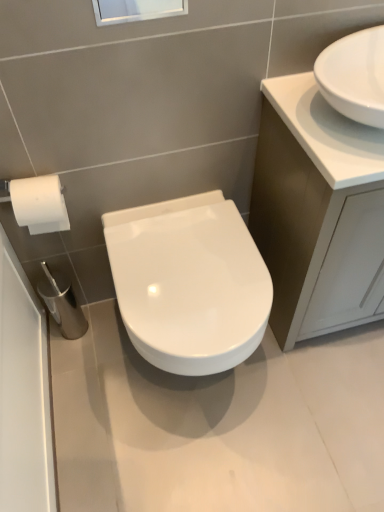
Question: Does transparent glass window screen at upper center turn towards white glossy sink at upper right?

Choices:
 (A) no
 (B) yes

Answer: (A)

Question: Could white glossy sink at upper right be considered to be inside transparent glass window screen at upper center?

Choices:
 (A) yes
 (B) no

Answer: (B)

Question: Is transparent glass window screen at upper center positioned before white glossy sink at upper right?

Choices:
 (A) yes
 (B) no

Answer: (B)

Question: Does transparent glass window screen at upper center touch white glossy sink at upper right?

Choices:
 (A) yes
 (B) no

Answer: (B)

Question: Is transparent glass window screen at upper center to the left of white glossy sink at upper right from the viewer's perspective?

Choices:
 (A) yes
 (B) no

Answer: (A)

Question: From their relative heights in the image, would you say white glossy cabinet at upper right is taller or shorter than white glossy sink at upper right?

Choices:
 (A) tall
 (B) short

Answer: (A)

Question: In the image, is white glossy cabinet at upper right on the left side or the right side of white glossy sink at upper right?

Choices:
 (A) right
 (B) left

Answer: (A)

Question: Looking at their shapes, would you say white glossy cabinet at upper right is wider or thinner than white glossy sink at upper right?

Choices:
 (A) wide
 (B) thin

Answer: (A)

Question: Is white glossy cabinet at upper right bigger or smaller than white glossy sink at upper right?

Choices:
 (A) small
 (B) big

Answer: (B)

Question: Do you think transparent glass window screen at upper center is within white glossy sink at upper right, or outside of it?

Choices:
 (A) outside
 (B) inside

Answer: (A)

Question: Is point (160, 15) closer or farther from the camera than point (291, 108)?

Choices:
 (A) farther
 (B) closer

Answer: (B)

Question: From the image's perspective, is transparent glass window screen at upper center located above or below white glossy sink at upper right?

Choices:
 (A) below
 (B) above

Answer: (B)

Question: Considering the positions of transparent glass window screen at upper center and white glossy sink at upper right in the image, is transparent glass window screen at upper center taller or shorter than white glossy sink at upper right?

Choices:
 (A) short
 (B) tall

Answer: (B)

Question: Is white glossy cabinet at upper right situated inside transparent glass window screen at upper center or outside?

Choices:
 (A) inside
 (B) outside

Answer: (B)

Question: Is point (286, 261) positioned closer to the camera than point (150, 2)?

Choices:
 (A) farther
 (B) closer

Answer: (A)